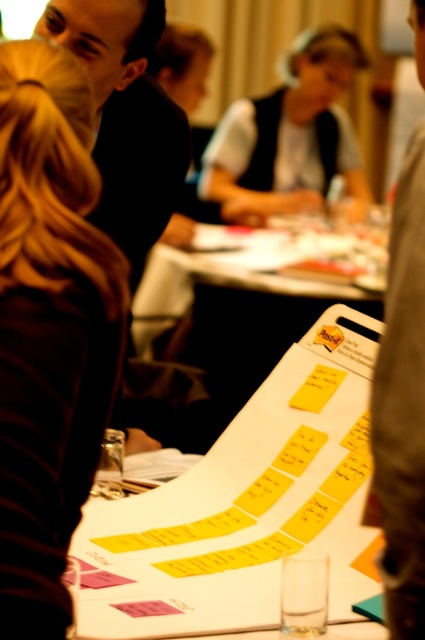
You are a person who needs to reach the yellow paper at center from the dark gray fabric jacket at center. Considering the distance between them is 8.42 feet, can you comfortably reach the yellow paper without moving your position?

The distance between the yellow paper at center and the dark gray fabric jacket at center is 8.42 feet. Since this distance is greater than an average person arm length, you cannot comfortably reach the yellow paper without moving your position.

You are standing at the back of the room and want to reach the yellow paper at center without disturbing the person in the dark gray fabric jacket at center. Which direction should you move relative to the jacket?

You should move to the left of the dark gray fabric jacket at center because the yellow paper at center is located to the left of it.